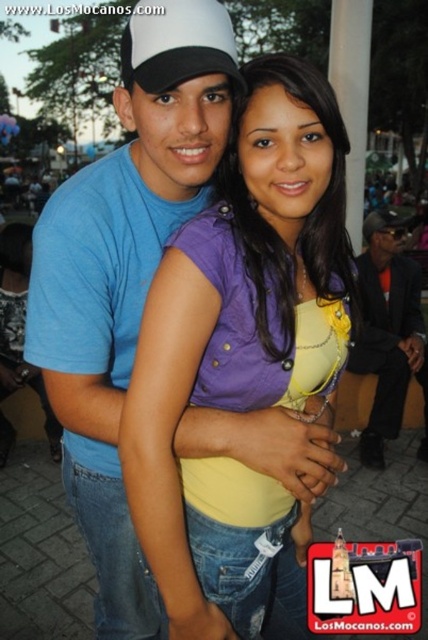
You are organizing a photo shoot and need to place two outfits in the scene. The purple denim shirt at center and the orange fabric suit at right must be positioned such that they don not overlap. Given their sizes, which outfit should be placed closer to the edge to avoid overlapping?

The purple denim shirt at center has a lesser width compared to the orange fabric suit at right, so placing the wider orange fabric suit at right closer to the edge would prevent overlapping since it requires more space.

You are organizing a clothing donation drive and need to categorize items by size. You have two items in front of you, the purple denim shirt at center and the orange fabric suit at right. Which item requires more storage space?

The orange fabric suit at right requires more storage space because the purple denim shirt at center is smaller than it.